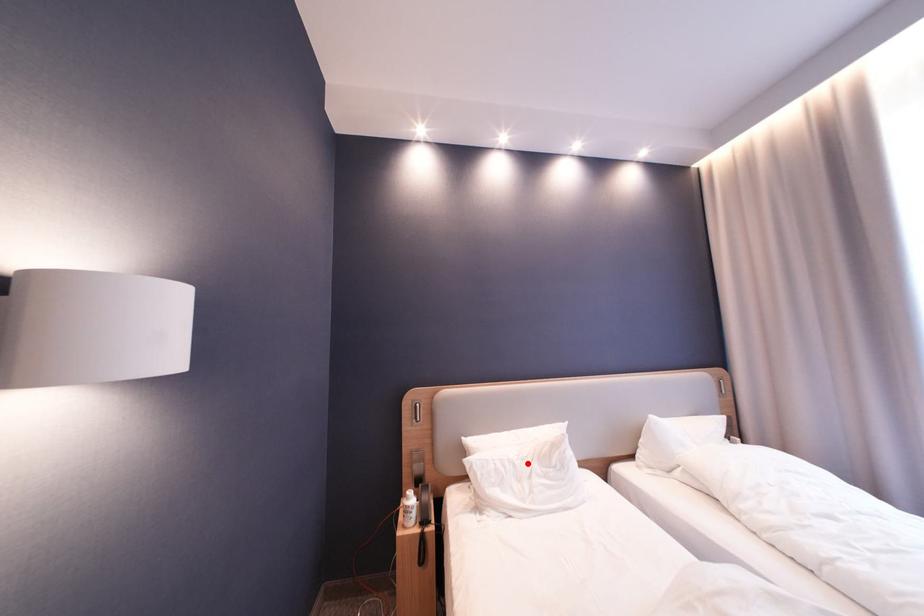
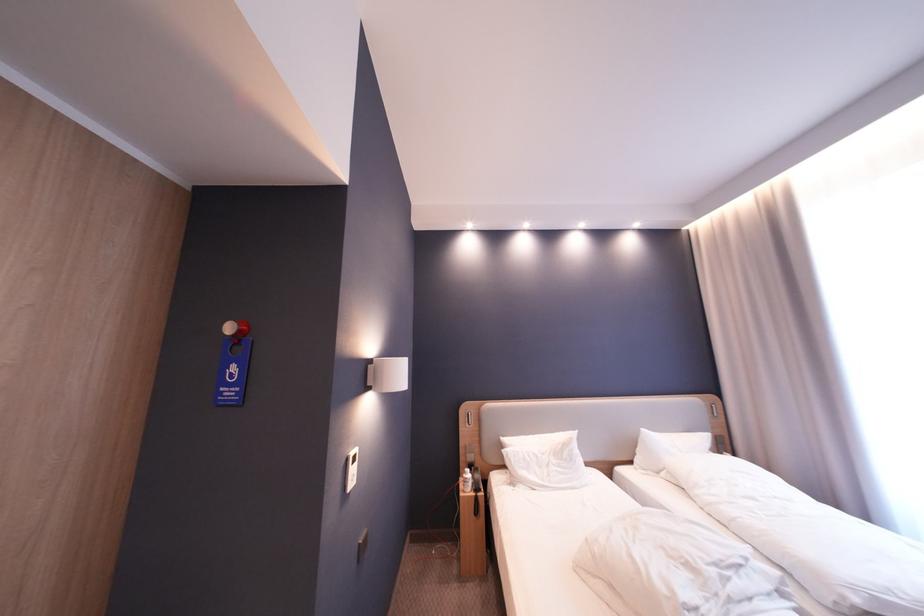
Find the pixel in the second image that matches the highlighted location in the first image.

(550, 456)